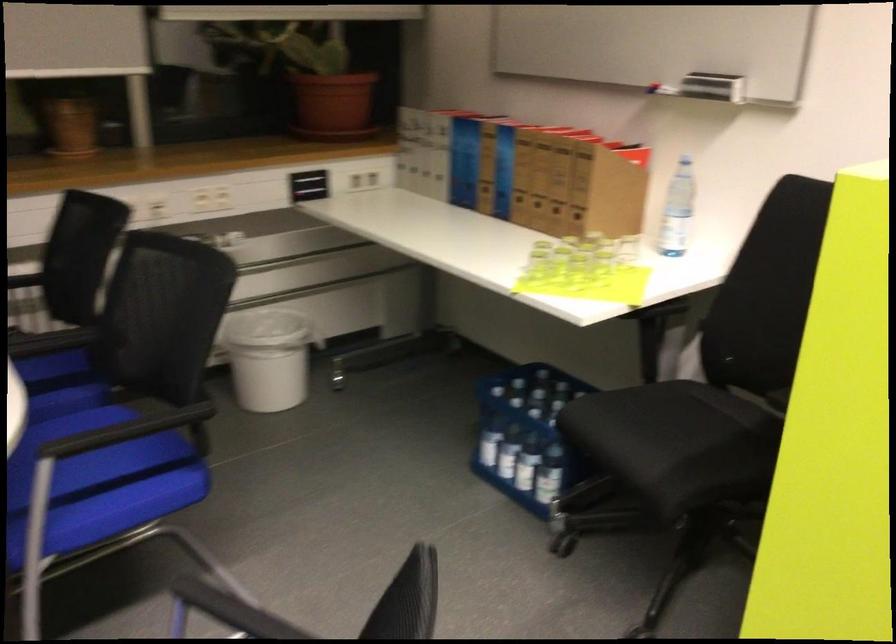
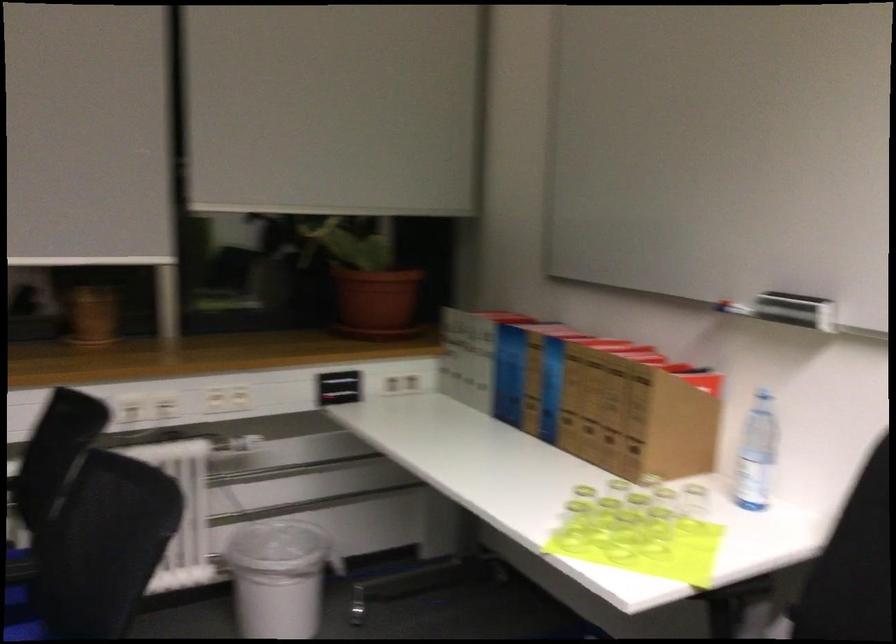
Locate, in the second image, the point that corresponds to (334,108) in the first image.

(375, 303)